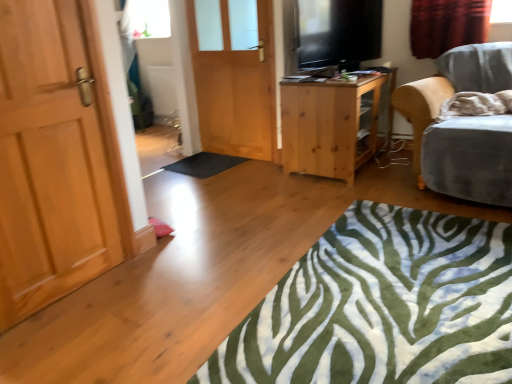
Where is `unoccupied region to the right of light brown wooden door at left, arranged as the second door when viewed from the right`? The image size is (512, 384). unoccupied region to the right of light brown wooden door at left, arranged as the second door when viewed from the right is located at coordinates (150, 288).